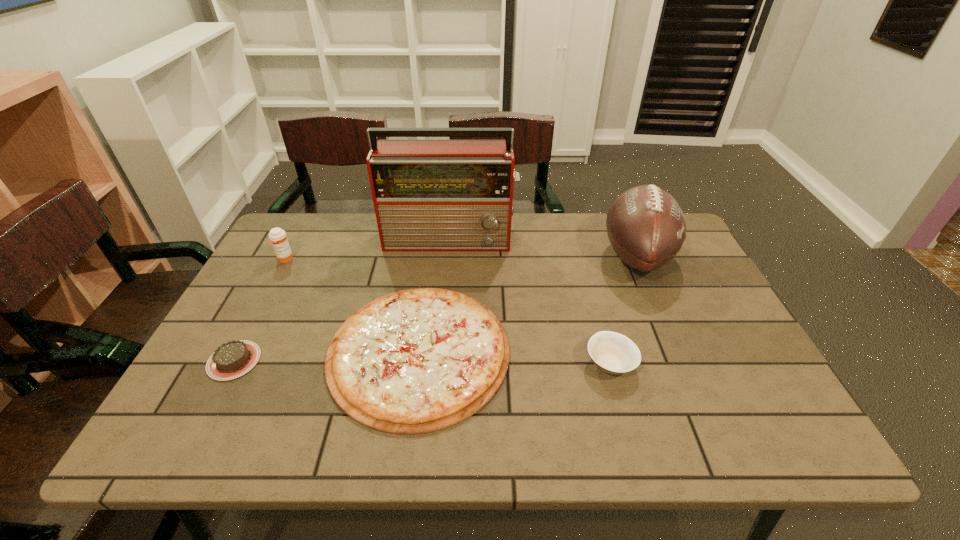
Where is `free space located 0.290m on the back of the chocolate cake`? The height and width of the screenshot is (540, 960). free space located 0.290m on the back of the chocolate cake is located at coordinates coord(284,266).

This screenshot has width=960, height=540. Find the location of `free location located 0.090m on the right of the pizza`. free location located 0.090m on the right of the pizza is located at coordinates (547, 352).

What are the coordinates of `radio receiver that is at the far edge` in the screenshot? It's located at (429, 195).

This screenshot has width=960, height=540. Identify the location of football (American) present at the far edge. (646, 227).

Where is `medicine that is positioned at the far edge`? The image size is (960, 540). medicine that is positioned at the far edge is located at coordinates (277, 236).

At what (x,y) coordinates should I click in order to perform the action: click on object located in the near edge section of the desktop. Please return your answer as a coordinate pair (x, y). Looking at the image, I should click on (415, 361).

Where is `medicine at the left edge`? Image resolution: width=960 pixels, height=540 pixels. medicine at the left edge is located at coordinates (277, 236).

At what (x,y) coordinates should I click in order to perform the action: click on chocolate cake present at the left edge. Please return your answer as a coordinate pair (x, y). This screenshot has width=960, height=540. Looking at the image, I should click on pos(233,359).

Identify the location of object located in the right edge section of the desktop. The image size is (960, 540). (646, 227).

Where is `object that is at the far left corner`? object that is at the far left corner is located at coordinates (277, 236).